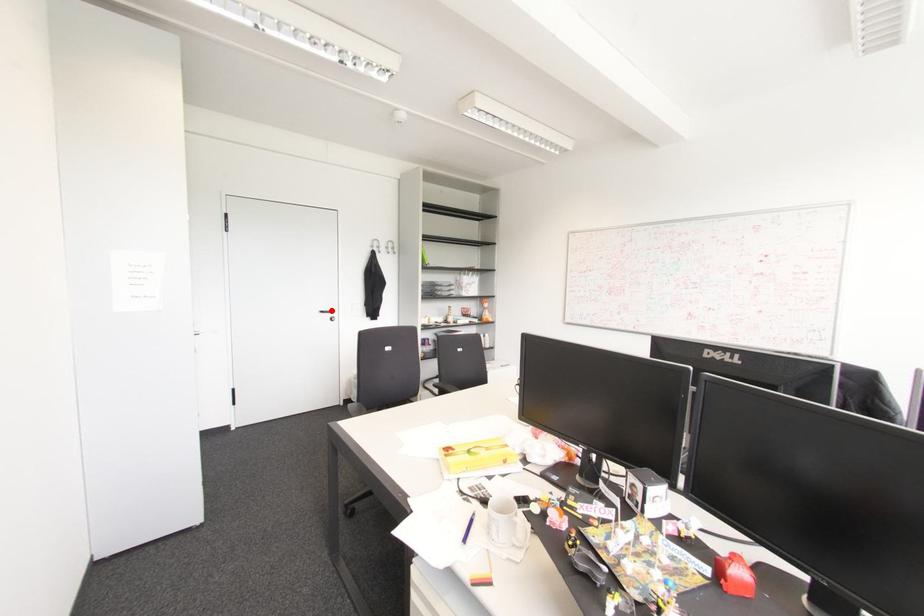
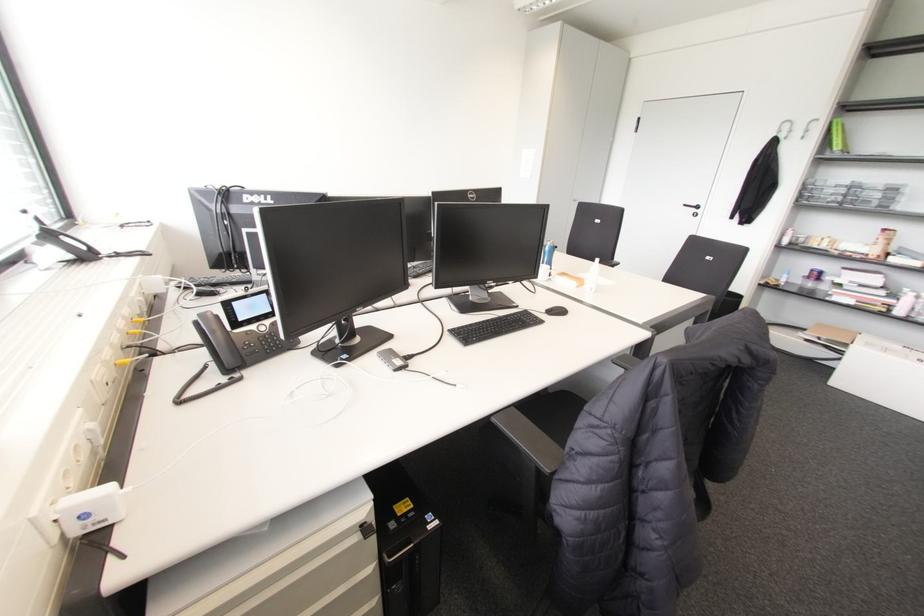
Where in the second image is the point corresponding to the highlighted location from the first image?

(697, 207)